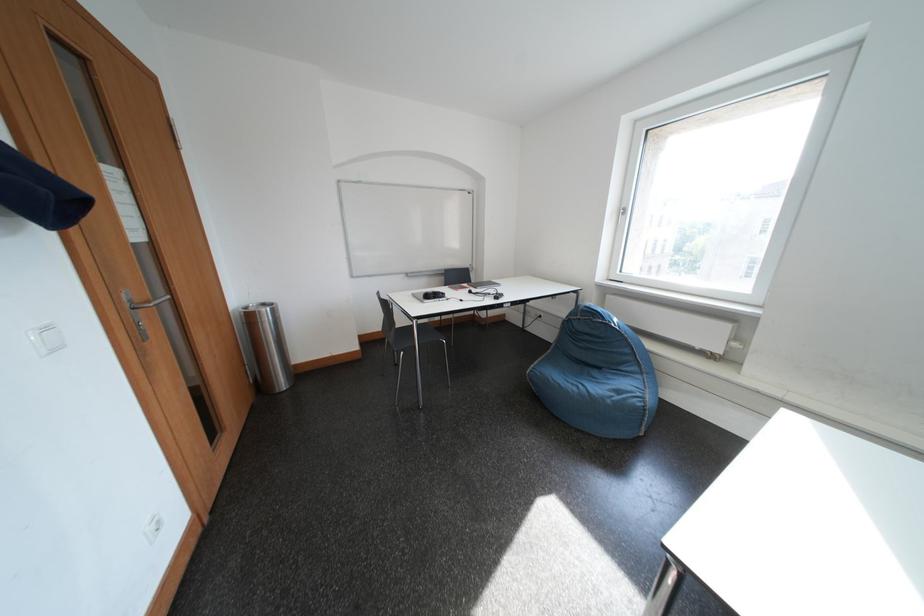
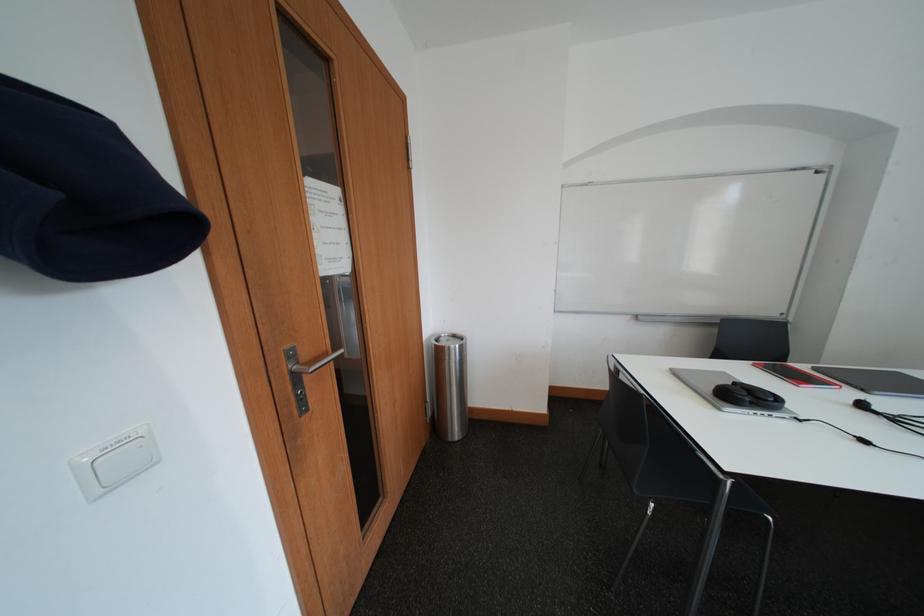
Question: The camera is either moving clockwise (left) or counter-clockwise (right) around the object. The first image is from the beginning of the video and the second image is from the end. Is the camera moving left or right when shooting the video?

Choices:
 (A) Left
 (B) Right

Answer: (B)